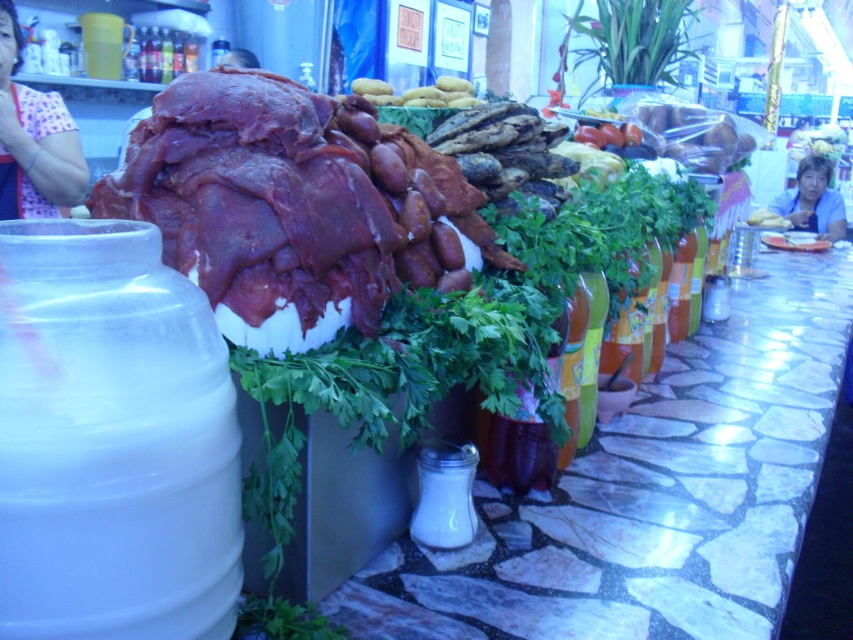
Question: Is pink floral shirt at upper left to the right of blue fabric shirt at upper right from the viewer's perspective?

Choices:
 (A) yes
 (B) no

Answer: (B)

Question: Which of these objects is positioned closest to the blue fabric shirt at upper right?

Choices:
 (A) pink floral shirt at upper left
 (B) golden brown bread at center
 (C) raw red meat at center

Answer: (B)

Question: Which object is the farthest from the blue fabric shirt at upper right?

Choices:
 (A) golden brown bread at center
 (B) pink floral shirt at upper left
 (C) raw red meat at center

Answer: (B)

Question: Which of the following is the farthest from the observer?

Choices:
 (A) golden brown bread at center
 (B) pink floral shirt at upper left
 (C) raw red meat at center

Answer: (B)

Question: Does blue fabric shirt at upper right lie behind golden brown bread at center?

Choices:
 (A) no
 (B) yes

Answer: (B)

Question: Is pink floral shirt at upper left positioned in front of golden brown bread at center?

Choices:
 (A) yes
 (B) no

Answer: (B)